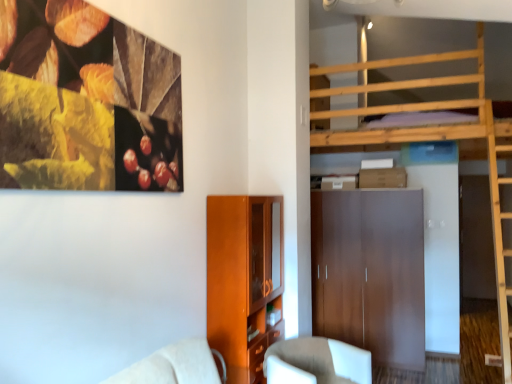
Question: Is matte brown wardrobe at center shorter than matte wood cabinet at lower center?

Choices:
 (A) yes
 (B) no

Answer: (B)

Question: Is matte brown wardrobe at center bigger than matte wood cabinet at lower center?

Choices:
 (A) no
 (B) yes

Answer: (B)

Question: Is matte brown wardrobe at center positioned with its back to matte wood cabinet at lower center?

Choices:
 (A) no
 (B) yes

Answer: (A)

Question: Is the depth of matte brown wardrobe at center greater than that of matte wood cabinet at lower center?

Choices:
 (A) yes
 (B) no

Answer: (A)

Question: Does matte brown wardrobe at center have a greater width compared to matte wood cabinet at lower center?

Choices:
 (A) yes
 (B) no

Answer: (A)

Question: From the image's perspective, is white fabric chair at lower center located above or below matte wood cabinet at lower center?

Choices:
 (A) above
 (B) below

Answer: (B)

Question: In terms of size, does white fabric chair at lower center appear bigger or smaller than matte wood cabinet at lower center?

Choices:
 (A) small
 (B) big

Answer: (A)

Question: Is white fabric chair at lower center wider or thinner than matte wood cabinet at lower center?

Choices:
 (A) wide
 (B) thin

Answer: (A)

Question: In the image, is white fabric chair at lower center positioned in front of or behind matte wood cabinet at lower center?

Choices:
 (A) front
 (B) behind

Answer: (A)

Question: Is matte brown wardrobe at center wider or thinner than white fabric chair at lower center?

Choices:
 (A) thin
 (B) wide

Answer: (A)

Question: Based on their positions, is matte brown wardrobe at center located to the left or right of white fabric chair at lower center?

Choices:
 (A) right
 (B) left

Answer: (A)

Question: Is matte brown wardrobe at center situated inside white fabric chair at lower center or outside?

Choices:
 (A) outside
 (B) inside

Answer: (A)

Question: Is point (395, 246) closer or farther from the camera than point (370, 367)?

Choices:
 (A) farther
 (B) closer

Answer: (A)

Question: From a real-world perspective, is matte brown wardrobe at center positioned above or below matte wood cabinet at lower center?

Choices:
 (A) below
 (B) above

Answer: (A)

Question: Considering the positions of matte brown wardrobe at center and matte wood cabinet at lower center in the image, is matte brown wardrobe at center bigger or smaller than matte wood cabinet at lower center?

Choices:
 (A) big
 (B) small

Answer: (A)